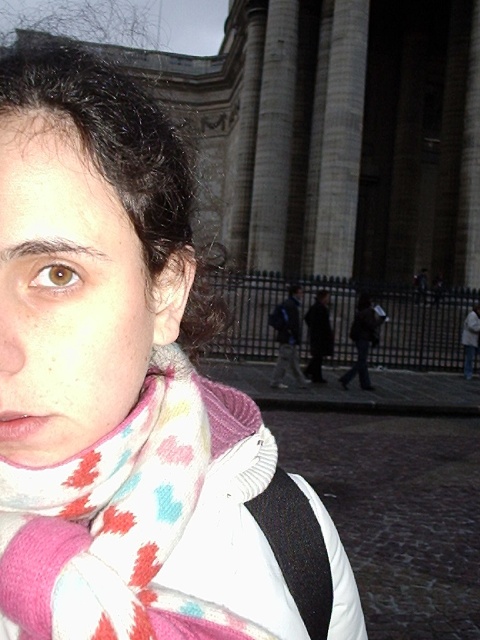
Between white and multicolored scarf at center and blue backpack at center, which one has less height?

With less height is white and multicolored scarf at center.

Is white and multicolored scarf at center taller than blue backpack at center?

In fact, white and multicolored scarf at center may be shorter than blue backpack at center.

Between point (136, 497) and point (292, 296), which one is positioned in front?

Point (136, 497) is in front.

Locate an element on the screen. This screenshot has width=480, height=640. white and multicolored scarf at center is located at coordinates (113, 525).